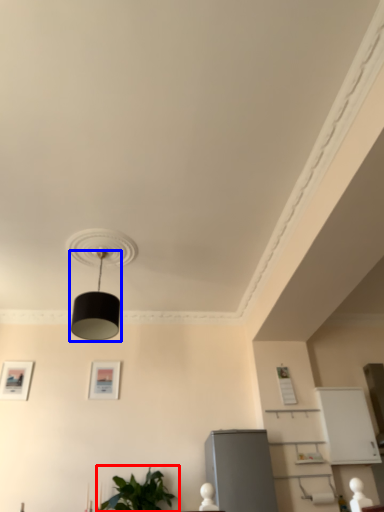
Question: Which of the following is the farthest to the observer, houseplant (highlighted by a red box) or lamp (highlighted by a blue box)?

Choices:
 (A) houseplant
 (B) lamp

Answer: (A)